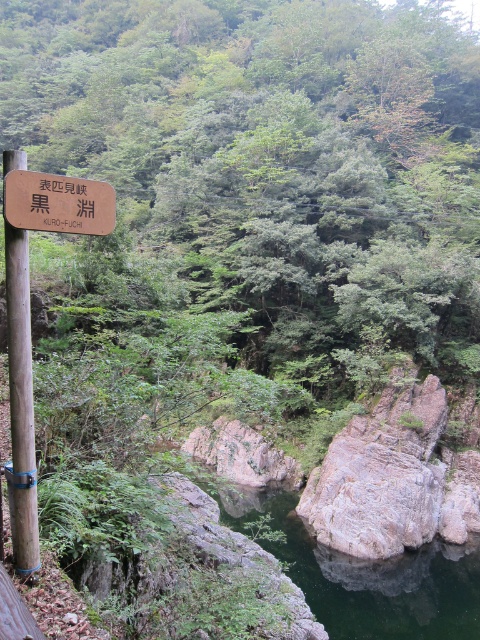
Between point (386, 566) and point (98, 204), which one is positioned behind?

Positioned behind is point (386, 566).

Between point (444, 545) and point (15, 198), which one is positioned behind?

The point (444, 545) is behind.

Locate an element on the screen. Image resolution: width=480 pixels, height=640 pixels. green smooth rock at center is located at coordinates (367, 577).

Who is taller, green smooth rock at center or brown wooden pole at left?

With more height is green smooth rock at center.

Can you confirm if green smooth rock at center is positioned to the right of brown wooden pole at left?

Correct, you'll find green smooth rock at center to the right of brown wooden pole at left.

Between point (244, 499) and point (20, 481), which one is positioned in front?

Positioned in front is point (20, 481).

Identify the location of green smooth rock at center. (367, 577).

Is point (2, 170) more distant than point (15, 225)?

That is True.

Image resolution: width=480 pixels, height=640 pixels. In order to click on brown wooden pole at left in this screenshot , I will do `click(21, 404)`.